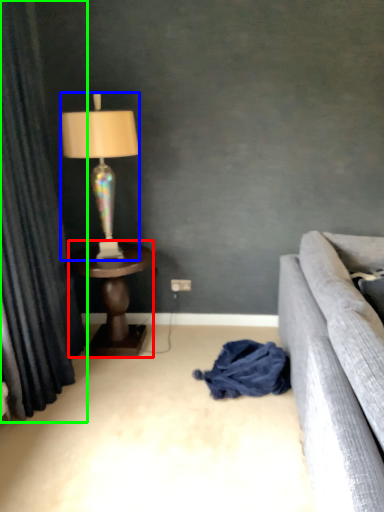
Question: Based on their relative distances, which object is farther from table (highlighted by a red box)? Choose from lamp (highlighted by a blue box) and curtain (highlighted by a green box).

Choices:
 (A) lamp
 (B) curtain

Answer: (A)